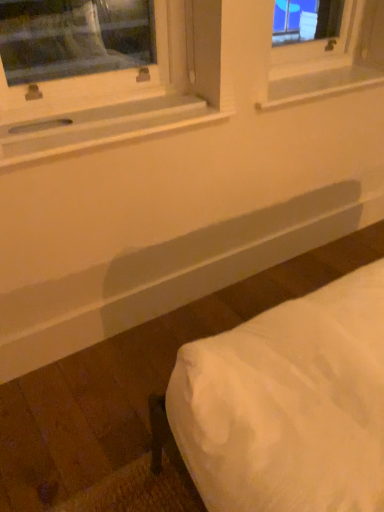
Question: From the image's perspective, is white wood window sill at upper left, the 1th window sill in the left-to-right sequence, above or below white plastic window sill at upper center, positioned as the second window sill in left-to-right order?

Choices:
 (A) above
 (B) below

Answer: (B)

Question: Is white wood window sill at upper left, which ranks as the 1th window sill in front-to-back order, wider or thinner than white plastic window sill at upper center, positioned as the second window sill in left-to-right order?

Choices:
 (A) wide
 (B) thin

Answer: (B)

Question: Based on their relative distances, which object is farther from the white wood window sill at upper left, positioned as the second window sill in right-to-left order?

Choices:
 (A) white fabric bed at lower right
 (B) white plastic window sill at upper center, placed as the first window sill when sorted from back to front

Answer: (A)

Question: Estimate the real-world distances between objects in this image. Which object is closer to the white plastic window sill at upper center, which ranks as the 1th window sill in right-to-left order?

Choices:
 (A) white wood window sill at upper left, which ranks as the 1th window sill in front-to-back order
 (B) white fabric bed at lower right

Answer: (A)